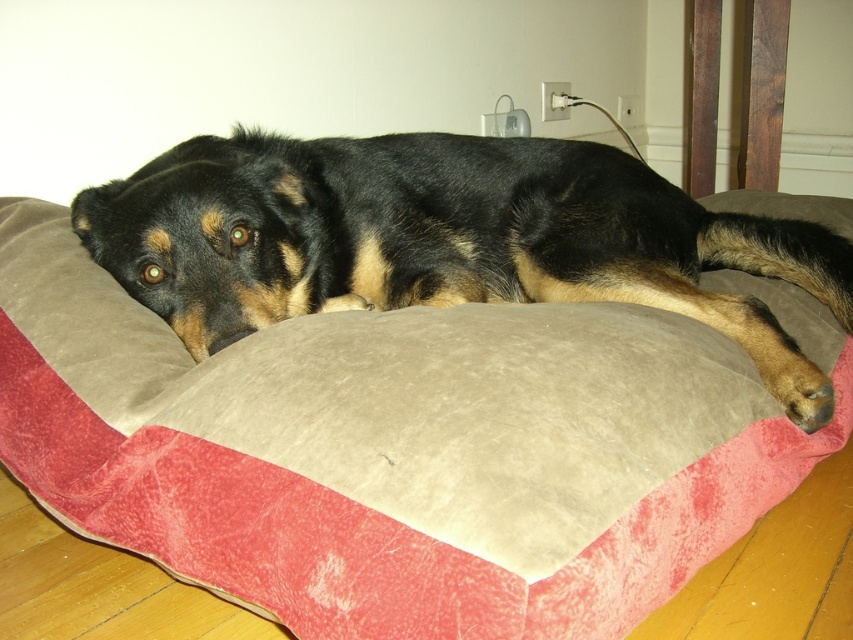
Is point (399, 460) less distant than point (248, 208)?

Yes, point (399, 460) is closer to viewer.

This screenshot has height=640, width=853. In order to click on velvet-like beige and red dog bed at center in this screenshot , I will do `click(401, 448)`.

Measure the distance between point [581,317] and camera.

They are 91.45 centimeters apart.

Where is `velvet-like beige and red dog bed at center`? velvet-like beige and red dog bed at center is located at coordinates (401, 448).